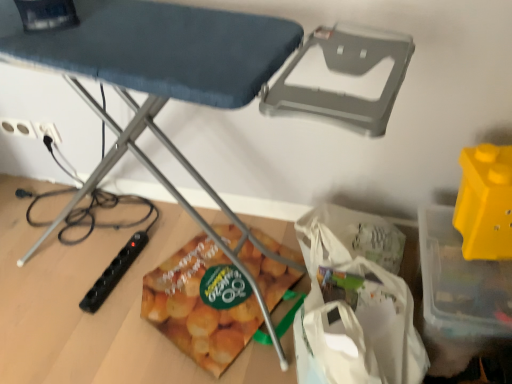
Find the location of a particular element. vacant space to the left of black plastic power strip at lower left, positioned as the first toy in back-to-front order is located at coordinates (64, 277).